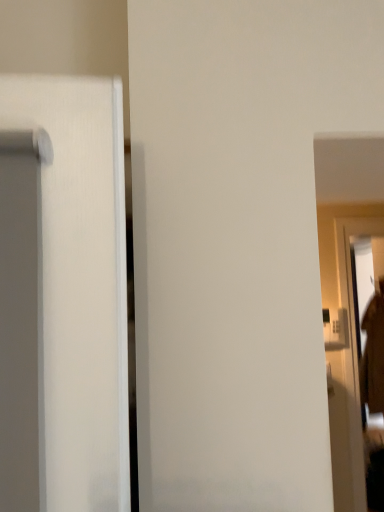
Image resolution: width=384 pixels, height=512 pixels. What do you see at coordinates (348, 376) in the screenshot?
I see `clear glass screen door at right` at bounding box center [348, 376].

This screenshot has height=512, width=384. I want to click on clear glass screen door at right, so click(x=348, y=376).

Measure the distance between point (x=348, y=387) and camera.

The depth of point (x=348, y=387) is 2.31 meters.

What do you see at coordinates (373, 354) in the screenshot? I see `brown fuzzy robe at right` at bounding box center [373, 354].

This screenshot has width=384, height=512. Find the location of `brown fuzzy robe at right`. brown fuzzy robe at right is located at coordinates point(373,354).

Identify the location of clear glass screen door at right. The height and width of the screenshot is (512, 384). (348, 376).

Consider the image. Is clear glass screen door at right to the left of brown fuzzy robe at right from the viewer's perspective?

Yes.

Which is behind, clear glass screen door at right or brown fuzzy robe at right?

brown fuzzy robe at right is further from the camera.

Which is further, (342,262) or (368,398)?

The point (368,398) is farther from the camera.

From the image's perspective, is clear glass screen door at right over brown fuzzy robe at right?

Indeed, from the image's perspective, clear glass screen door at right is shown above brown fuzzy robe at right.

From a real-world perspective, which is physically above, clear glass screen door at right or brown fuzzy robe at right?

From a 3D spatial view, clear glass screen door at right is above.

Does clear glass screen door at right have a greater width compared to brown fuzzy robe at right?

No.

Who is taller, clear glass screen door at right or brown fuzzy robe at right?

clear glass screen door at right.

In the scene shown: Who is bigger, clear glass screen door at right or brown fuzzy robe at right?

brown fuzzy robe at right.

Is brown fuzzy robe at right located within clear glass screen door at right?

That's incorrect, brown fuzzy robe at right is not inside clear glass screen door at right.

Is clear glass screen door at right not close to brown fuzzy robe at right?

clear glass screen door at right is near brown fuzzy robe at right, not far away.

Could you tell me if clear glass screen door at right is facing brown fuzzy robe at right?

No.

How different are the orientations of clear glass screen door at right and brown fuzzy robe at right in degrees?

91.5 degrees separate the facing orientations of clear glass screen door at right and brown fuzzy robe at right.

Where is `screen door above the brown fuzzy robe at right (from the image's perspective)`? The image size is (384, 512). screen door above the brown fuzzy robe at right (from the image's perspective) is located at coordinates (348, 376).

Does brown fuzzy robe at right appear on the left side of clear glass screen door at right?

In fact, brown fuzzy robe at right is to the right of clear glass screen door at right.

Between brown fuzzy robe at right and clear glass screen door at right, which one is positioned behind?

Positioned behind is brown fuzzy robe at right.

Considering the points (368, 398) and (332, 446), which point is in front, point (368, 398) or point (332, 446)?

The point (332, 446) is closer to the camera.

From the image's perspective, would you say brown fuzzy robe at right is positioned over clear glass screen door at right?

Incorrect, from the image's perspective, brown fuzzy robe at right is lower than clear glass screen door at right.

From a real-world perspective, is brown fuzzy robe at right positioned under clear glass screen door at right based on gravity?

Correct, in the physical world, brown fuzzy robe at right is lower than clear glass screen door at right.

Which object is wider, brown fuzzy robe at right or clear glass screen door at right?

brown fuzzy robe at right is wider.

Is brown fuzzy robe at right taller or shorter than clear glass screen door at right?

Clearly, brown fuzzy robe at right is shorter compared to clear glass screen door at right.

Considering the relative sizes of brown fuzzy robe at right and clear glass screen door at right in the image provided, is brown fuzzy robe at right smaller than clear glass screen door at right?

No, brown fuzzy robe at right is not smaller than clear glass screen door at right.

Looking at this image, is brown fuzzy robe at right located outside clear glass screen door at right?

Result: Indeed, brown fuzzy robe at right is completely outside clear glass screen door at right.

Would you consider brown fuzzy robe at right to be distant from clear glass screen door at right?

No, brown fuzzy robe at right is not far from clear glass screen door at right.

Does brown fuzzy robe at right turn towards clear glass screen door at right?

No, brown fuzzy robe at right is not facing towards clear glass screen door at right.

What's the angular difference between brown fuzzy robe at right and clear glass screen door at right's facing directions?

91.5 degrees separate the facing orientations of brown fuzzy robe at right and clear glass screen door at right.

Identify the location of screen door above the brown fuzzy robe at right (from a real-world perspective). Image resolution: width=384 pixels, height=512 pixels. (348, 376).

Locate an element on the screen. The image size is (384, 512). robe on the right of clear glass screen door at right is located at coordinates (373, 354).

This screenshot has width=384, height=512. What are the coordinates of `screen door above the brown fuzzy robe at right (from a real-world perspective)` in the screenshot? It's located at (348, 376).